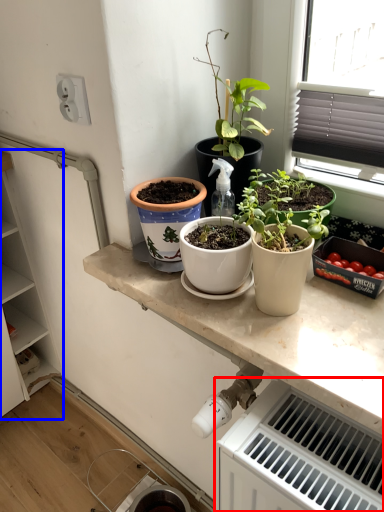
Question: Which object is further to the camera taking this photo, radiator (highlighted by a red box) or cabinetry (highlighted by a blue box)?

Choices:
 (A) radiator
 (B) cabinetry

Answer: (B)